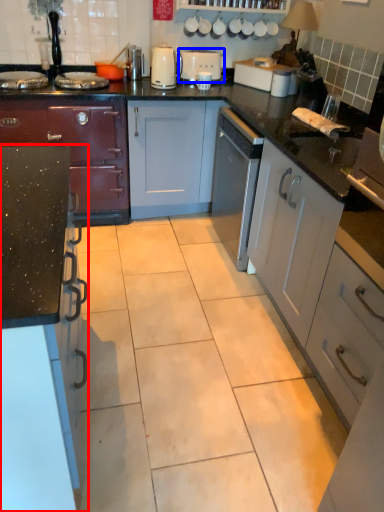
Question: Which object is further to the camera taking this photo, cabinetry (highlighted by a red box) or appliance (highlighted by a blue box)?

Choices:
 (A) cabinetry
 (B) appliance

Answer: (B)